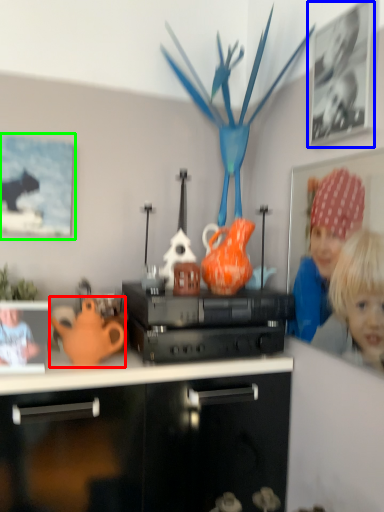
Question: Which object is the farthest from teapot (highlighted by a red box)? Choose among these: picture frame (highlighted by a blue box) or picture frame (highlighted by a green box).

Choices:
 (A) picture frame
 (B) picture frame

Answer: (A)